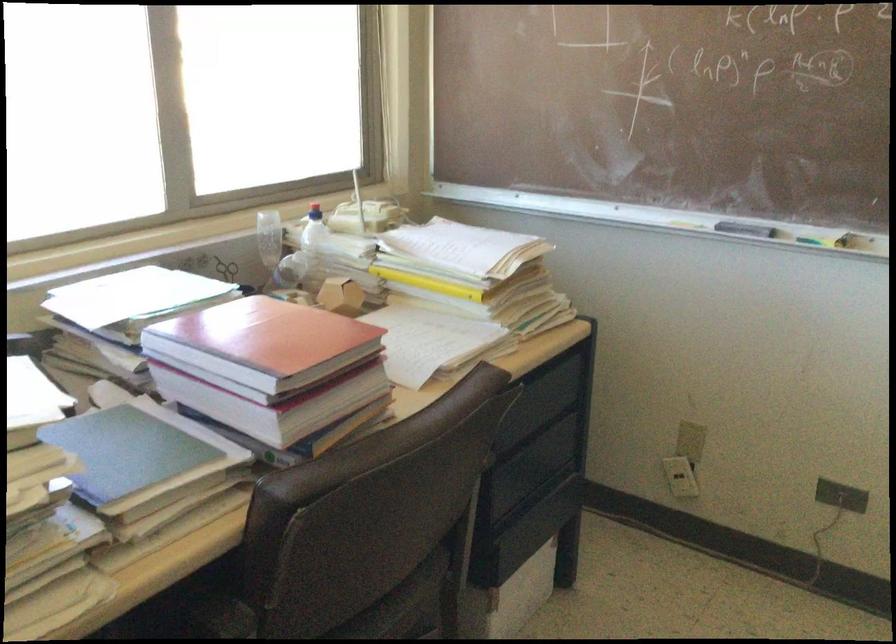
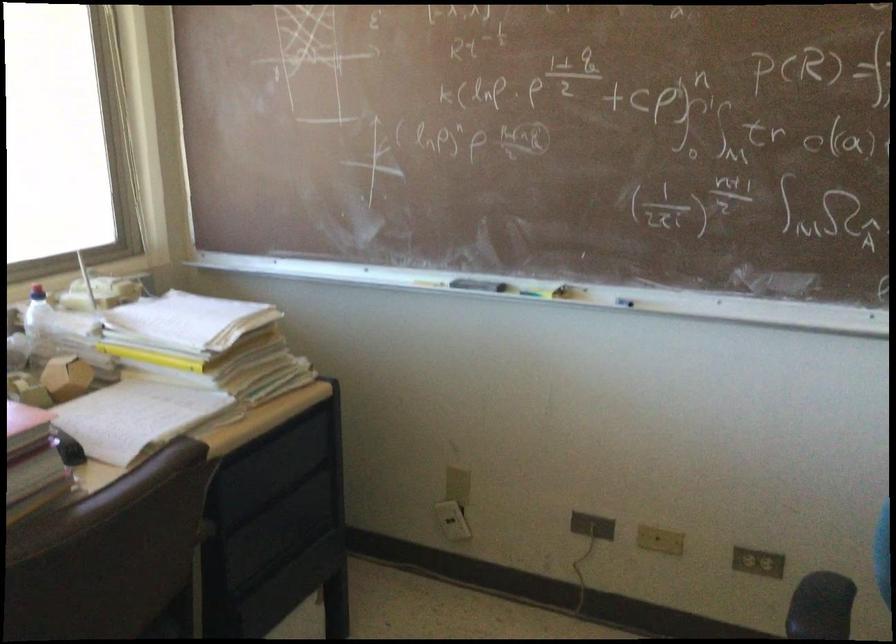
Question: The camera is either moving clockwise (left) or counter-clockwise (right) around the object. The first image is from the beginning of the video and the second image is from the end. Is the camera moving left or right when shooting the video?

Choices:
 (A) Left
 (B) Right

Answer: (A)